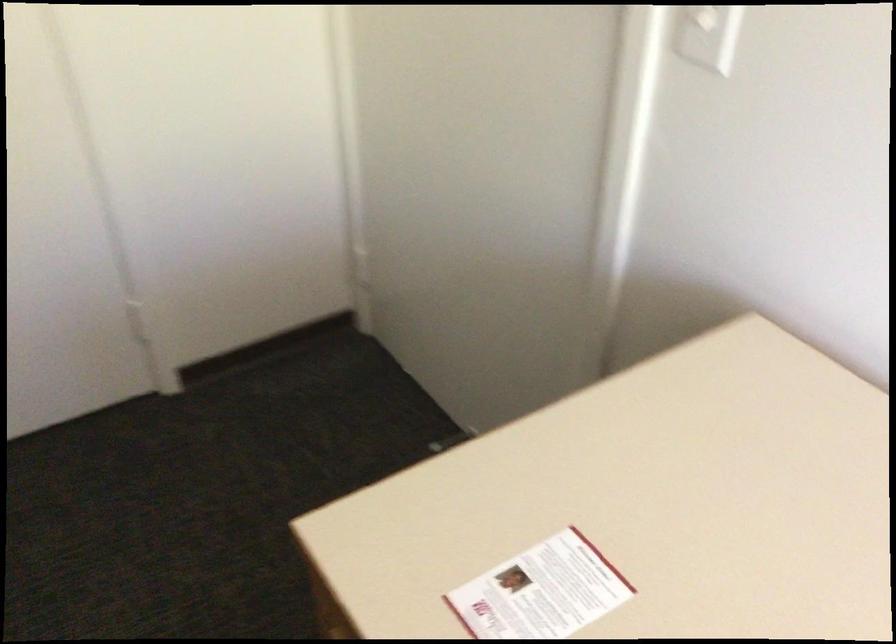
Identify the location of white light switch. (703, 17).